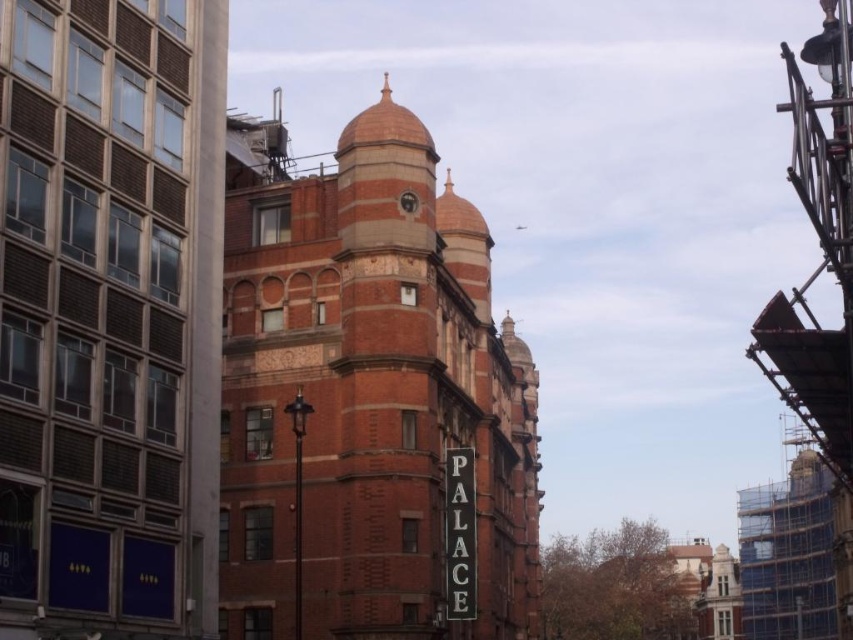
Question: Which object appears farthest from the camera in this image?

Choices:
 (A) red brick building at center
 (B) brass metallic clock at center

Answer: (B)

Question: Does red brick building at center come behind brass metallic clock at center?

Choices:
 (A) no
 (B) yes

Answer: (A)

Question: Is the position of red brick building at center more distant than that of brass metallic clock at center?

Choices:
 (A) no
 (B) yes

Answer: (A)

Question: Which of the following is the closest to the observer?

Choices:
 (A) red brick building at center
 (B) brass metallic clock at center

Answer: (A)

Question: Is red brick building at center below brass metallic clock at center?

Choices:
 (A) yes
 (B) no

Answer: (A)